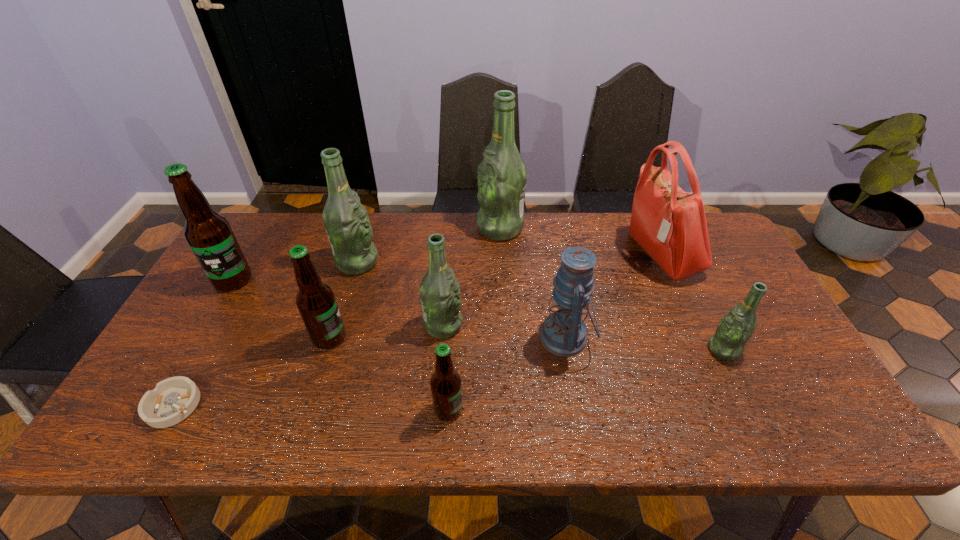
I want to click on vacant point located on the front-facing side of the red handbag, so click(x=538, y=254).

I want to click on vacant position located on the front-facing side of the red handbag, so click(x=553, y=254).

Locate an element on the screen. The image size is (960, 540). vacant space situated 0.160m on the surface of the second biggest green beer bottle is located at coordinates (431, 262).

Where is `vacant region located 0.260m on the label of the leftmost brown beer bottle`? This screenshot has width=960, height=540. vacant region located 0.260m on the label of the leftmost brown beer bottle is located at coordinates (181, 370).

Find the location of a particular element. This screenshot has height=540, width=960. vacant position located on the surface of the third biggest green beer bottle is located at coordinates (541, 325).

Identify the location of vacant region located 0.240m on the label of the second farthest brown beer bottle. click(x=439, y=338).

In order to click on free space located on the front-facing side of the eighth object from left to right in this screenshot , I will do `click(478, 338)`.

I want to click on free space located 0.170m on the front-facing side of the eighth object from left to right, so click(x=474, y=338).

Locate an element on the screen. vacant region located on the front-facing side of the eighth object from left to right is located at coordinates (493, 338).

Find the location of a particular element. The image size is (960, 540). free space located 0.160m on the label of the nearest brown beer bottle is located at coordinates click(534, 409).